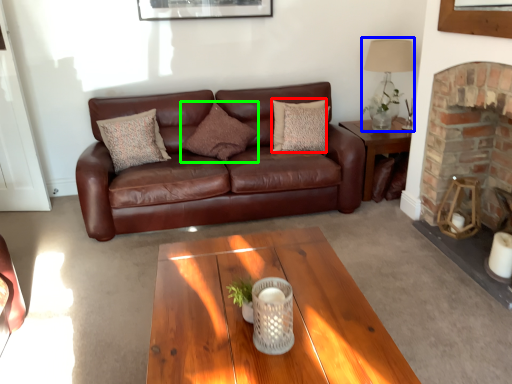
Question: Estimate the real-world distances between objects in this image. Which object is farther from pillow (highlighted by a red box), lamp (highlighted by a blue box) or pillow (highlighted by a green box)?

Choices:
 (A) lamp
 (B) pillow

Answer: (A)